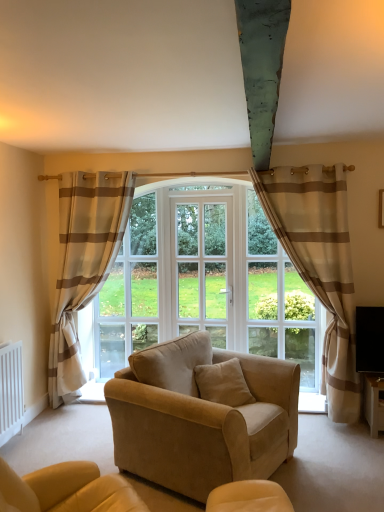
Locate an element on the screen. The width and height of the screenshot is (384, 512). free space above white glass screen door at center (from a real-world perspective) is located at coordinates (198, 197).